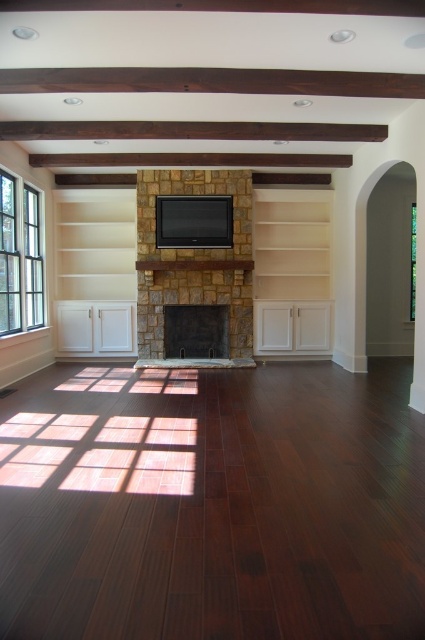
Question: Considering the relative positions of clear glass window at left and clear glass window at right in the image provided, where is clear glass window at left located with respect to clear glass window at right?

Choices:
 (A) above
 (B) below

Answer: (B)

Question: Can you confirm if black stone fireplace at center is positioned above clear glass window at right?

Choices:
 (A) yes
 (B) no

Answer: (B)

Question: Can you confirm if black stone fireplace at center is positioned to the right of clear glass window at right?

Choices:
 (A) no
 (B) yes

Answer: (A)

Question: Considering the real-world distances, which object is farthest from the clear glass window at left?

Choices:
 (A) clear glass window at right
 (B) stone fireplace at center
 (C) black stone fireplace at center

Answer: (A)

Question: Which point is farther from the camera taking this photo?

Choices:
 (A) (149, 307)
 (B) (200, 332)

Answer: (B)

Question: Which of the following is the closest to the observer?

Choices:
 (A) stone fireplace at center
 (B) clear glass window at left
 (C) black stone fireplace at center
 (D) clear glass window at right

Answer: (B)